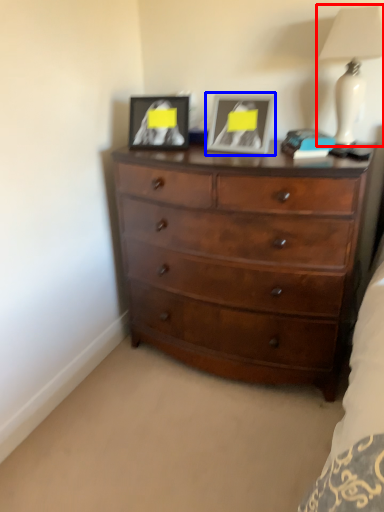
Question: Which point is further to the camera, lamp (highlighted by a red box) or picture frame (highlighted by a blue box)?

Choices:
 (A) lamp
 (B) picture frame

Answer: (B)